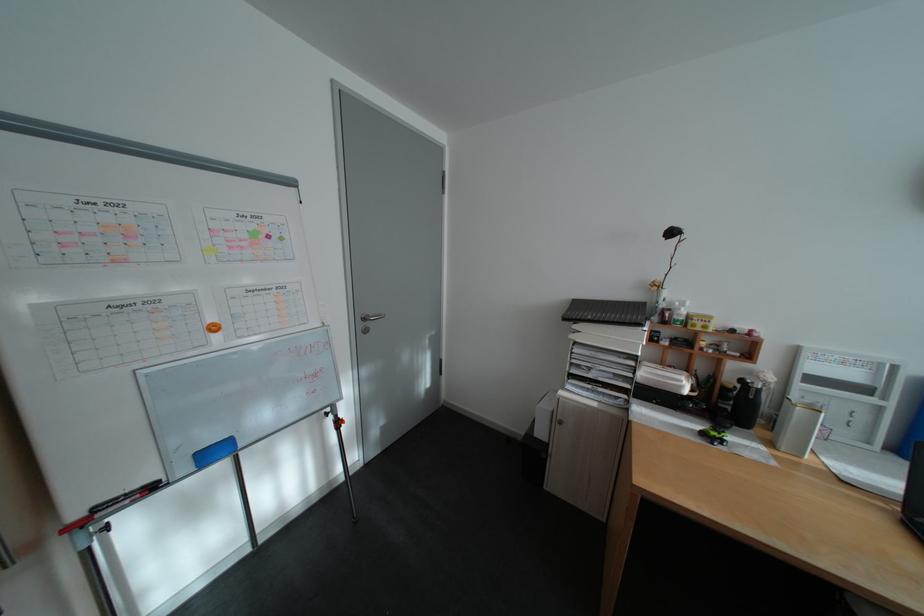
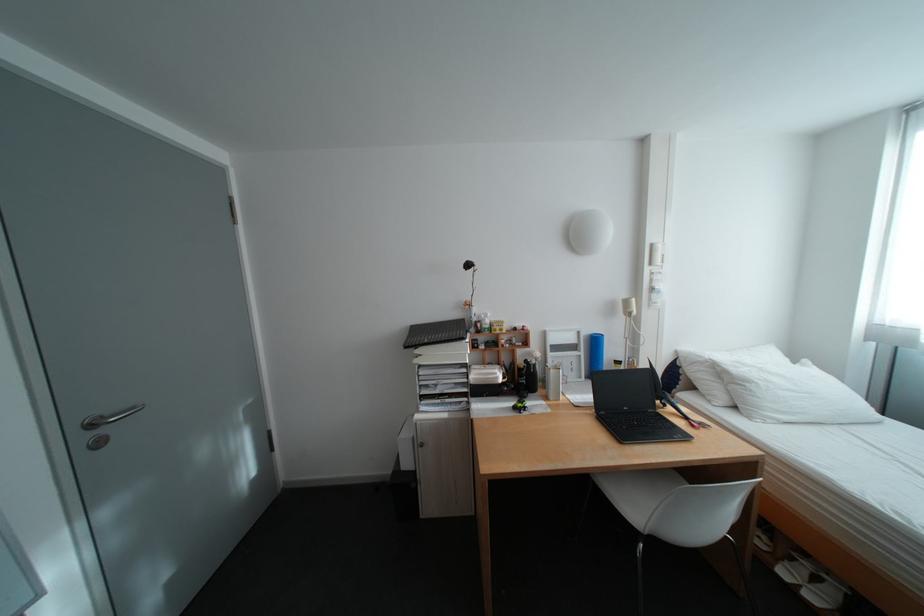
The point at (650, 357) is marked in the first image. Where is the corresponding point in the second image?

(480, 363)